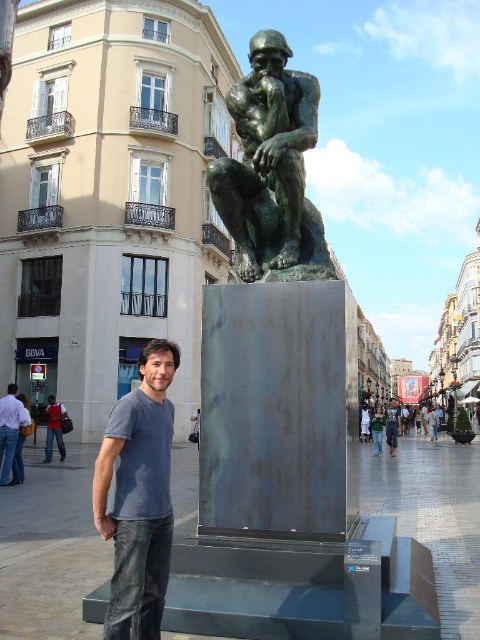
Question: Does blue denim jeans at lower left have a greater width compared to gray cotton shirt at center?

Choices:
 (A) yes
 (B) no

Answer: (A)

Question: Is bronze statue at center further to camera compared to blue denim jeans at lower left?

Choices:
 (A) yes
 (B) no

Answer: (A)

Question: Which of the following is the farthest from the observer?

Choices:
 (A) (290, 244)
 (B) (120, 554)

Answer: (A)

Question: Based on their relative distances, which object is nearer to the gray cotton shirt at center?

Choices:
 (A) blue denim jeans at lower left
 (B) bronze statue at center

Answer: (A)

Question: Is bronze statue at center closer to camera compared to gray cotton shirt at center?

Choices:
 (A) yes
 (B) no

Answer: (A)

Question: Which point is farther from the camera taking this photo?

Choices:
 (A) (24, 422)
 (B) (132, 612)
 (C) (297, 141)

Answer: (A)